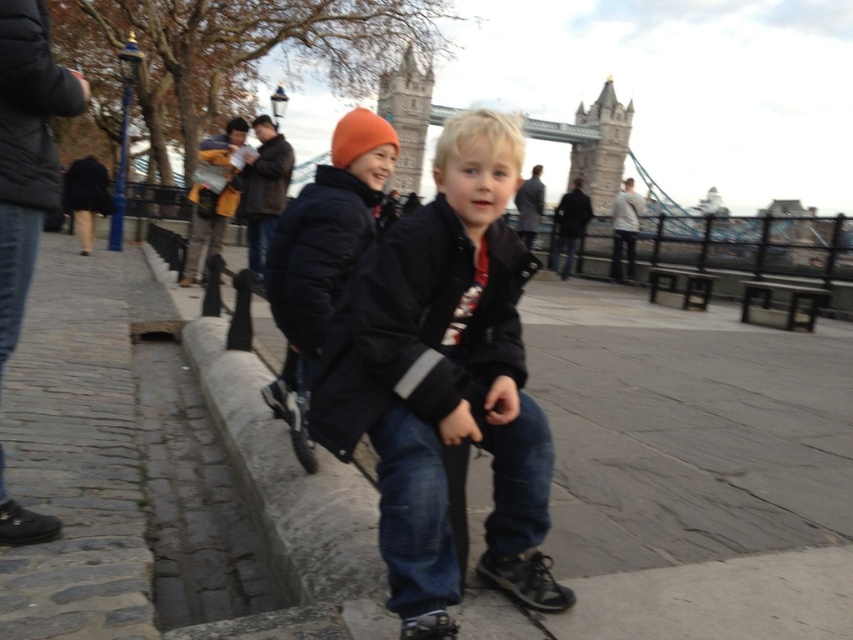
You are a tourist standing at the walkway near the Tower Bridge. You see the black matte jacket at center and the stone tower bridge at center. Which one is closer to the ground?

The black matte jacket at center is shorter than the stone tower bridge at center, so the black matte jacket at center is closer to the ground.

You are standing in the walkway near Tower Bridge and see two points marked in the scene. Which point is closer to you, point [778,524] or point [387,435]?

Point [778,524] is further to the viewer than point [387,435], so the closer point is point [387,435].